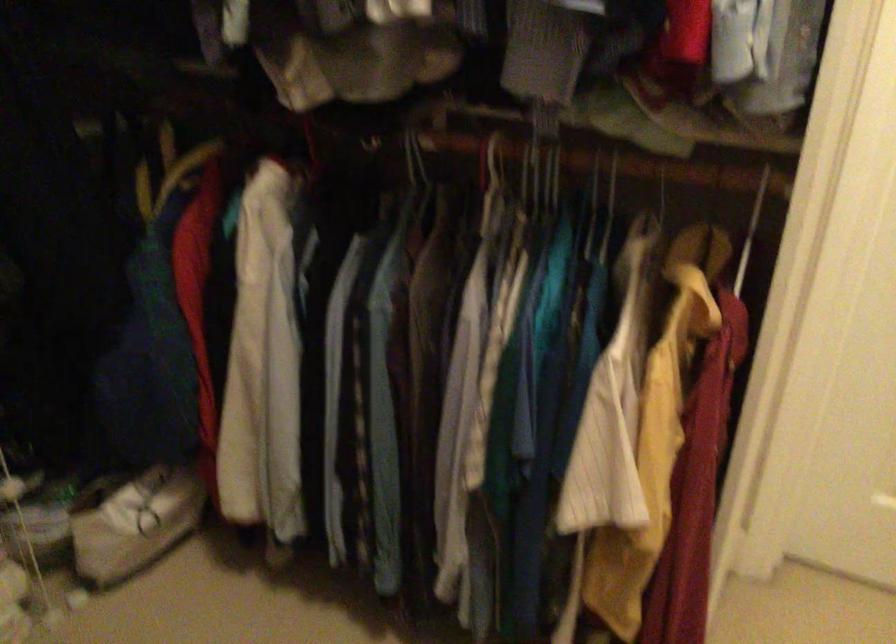
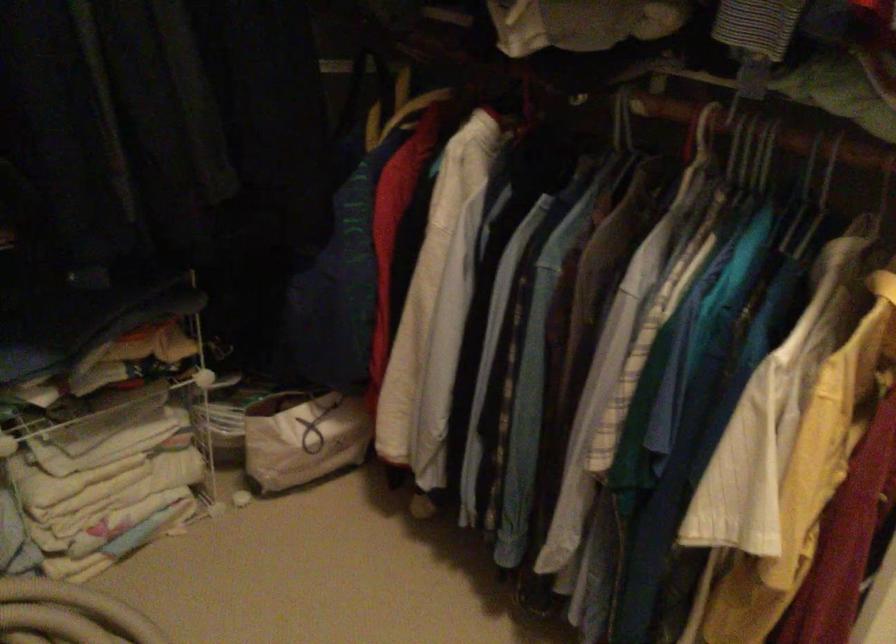
In the second image, find the point that corresponds to (x=415, y=155) in the first image.

(622, 122)